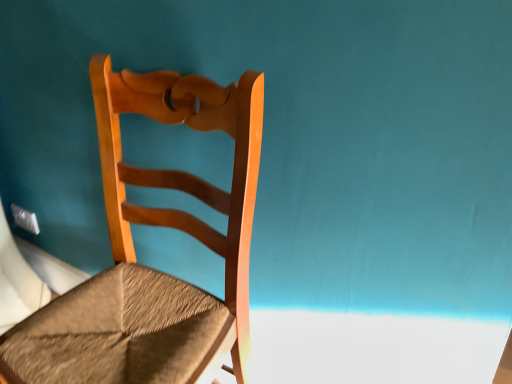
This screenshot has width=512, height=384. Describe the element at coordinates (148, 267) in the screenshot. I see `glossy wood chair at left` at that location.

What is the approximate height of glossy wood chair at left?

glossy wood chair at left is 37.68 inches in height.

The width and height of the screenshot is (512, 384). In order to click on glossy wood chair at left in this screenshot , I will do `click(148, 267)`.

I want to click on glossy wood chair at left, so click(x=148, y=267).